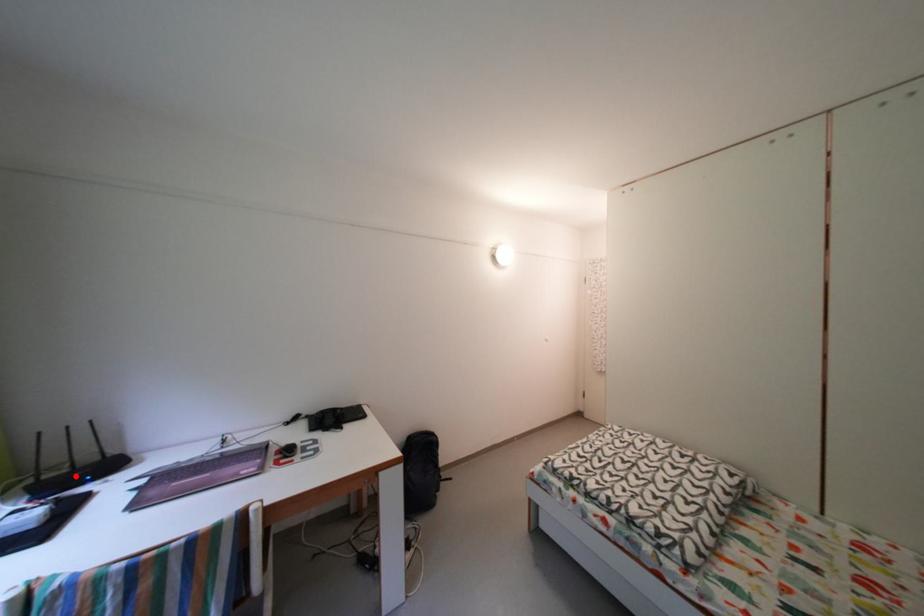
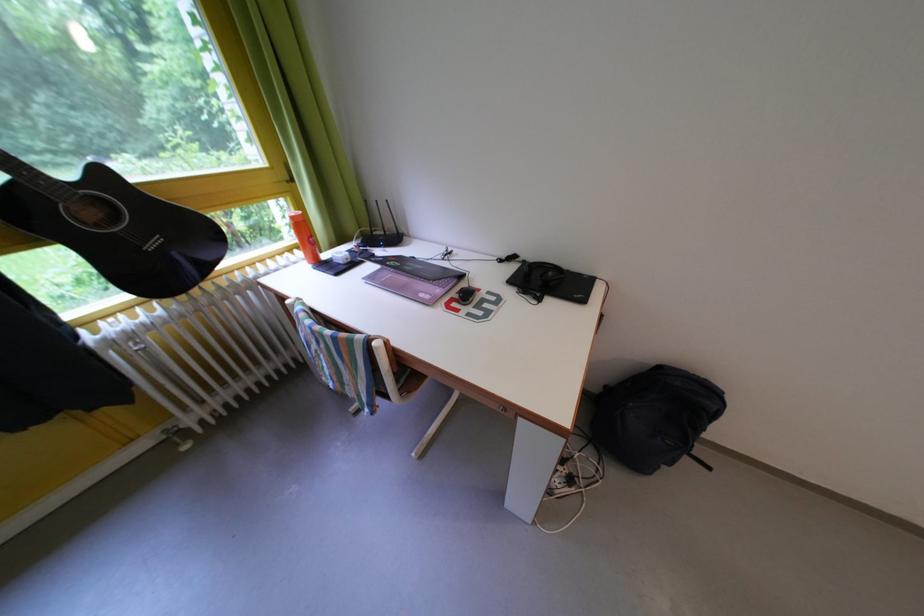
Question: I am providing you with two images of the same scene from different viewpoints. Image1 has a red point marked. In image2, the corresponding 3D location appears at what relative position? Reply with the corresponding letter.

Choices:
 (A) Closer
 (B) Farther

Answer: (A)